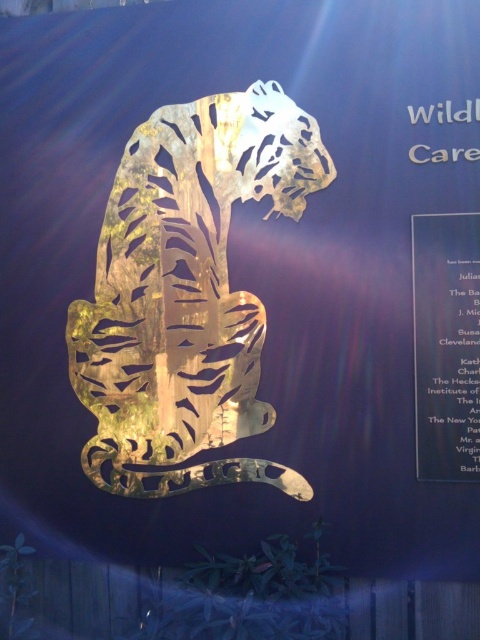
You are an artist planning to photograph the gold reflective tiger at center and the metallic gold plaque at right. Since you want to focus on the tiger, will the plaque be visible in the background when you take the photo from the front?

The metallic gold plaque at right is behind the gold reflective tiger at center, so it will be visible in the background when taking the photo from the front.

You are an event planner setting up a venue. You need to place a 2m wide banner between the gold reflective tiger at center and the metallic gold plaque at right. Can you fit the banner between them?

The gold reflective tiger at center is wider than the metallic gold plaque at right. Therefore, the 2m wide banner may not fit between them as the space available might be narrower than 2 meters.

You are an art curator planning to move the gold reflective tiger at center closer to the entrance. The entrance is on the left side of the room. Which direction should you move the metallic gold plaque at right to keep it aligned with the tiger?

Since the gold reflective tiger at center is currently to the left of the metallic gold plaque at right, to keep them aligned when moving the tiger closer to the entrance on the left, you should move the metallic gold plaque at right further to the right to maintain their relative positions.